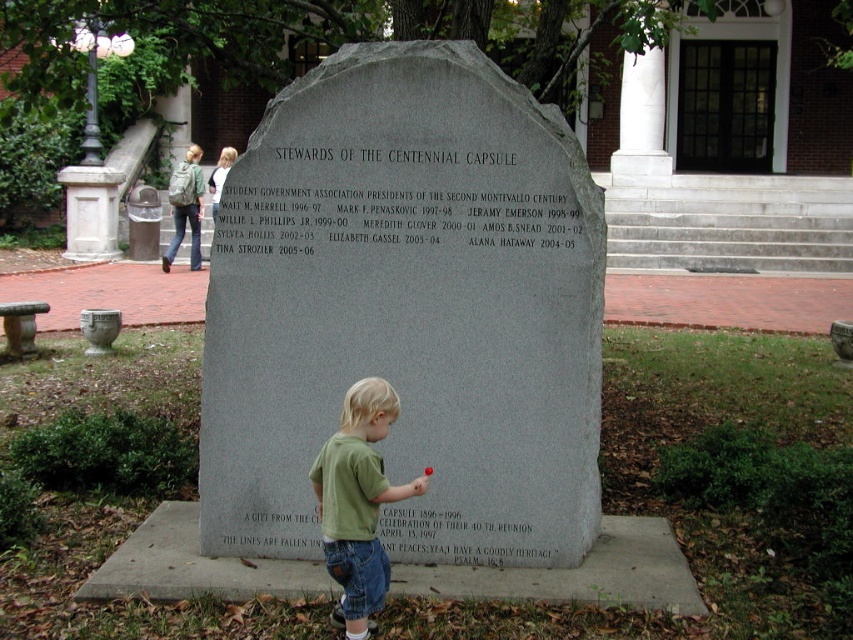
You are holding a camera and want to take a photo of the gray stone monument at center. If you are standing 3.36 meters away from the monument, is this distance sufficient to capture the entire monument in one frame?

The gray stone monument at center and camera are 3.36 meters apart from each other. This distance may be sufficient depending on the camera lens used. A standard lens might require stepping back further, while a wide angle lens could capture the entire monument from this distance.

You are standing in front of the monument and want to touch both the gray stone plaque at center and the matte gray stone at lower center. Which one would you need to reach out further to touch?

You would need to reach further to touch the matte gray stone at lower center because it is farther from you compared to the gray stone plaque at center, which is closer.

You are a tour guide explaining the monument to visitors. You want to mention the size difference between the two gray stone elements. How does the size of the gray stone plaque at center compare to the matte gray stone at lower center?

The gray stone plaque at center is bigger than the matte gray stone at lower center.